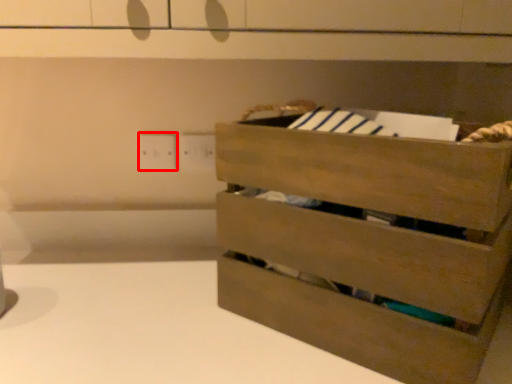
Question: From the image's perspective, where is electric outlet (annotated by the red box) located in relation to chest of drawers in the image?

Choices:
 (A) above
 (B) below

Answer: (A)